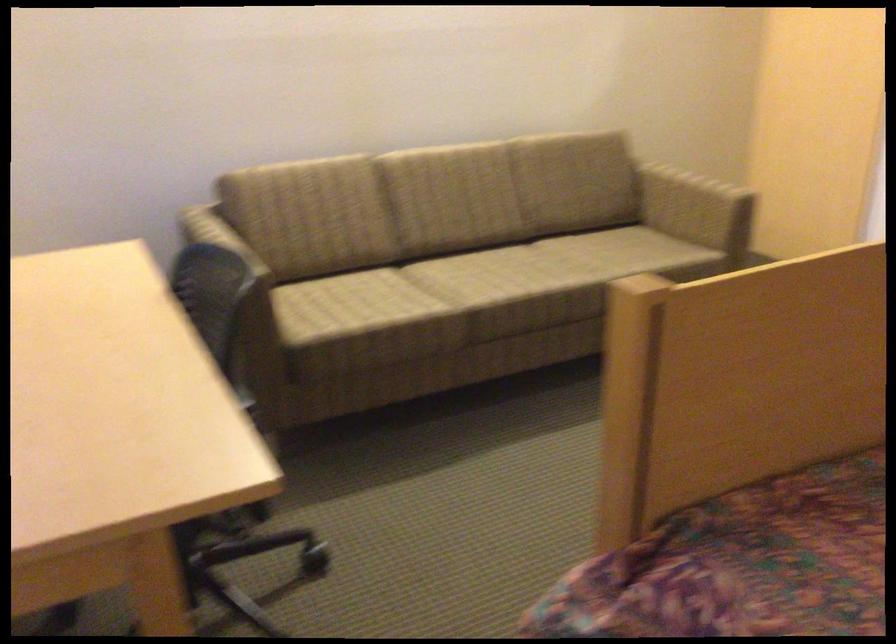
Find where to sit the sofa sitting surface. Please return your answer as a coordinate pair (x, y).

(470, 279)